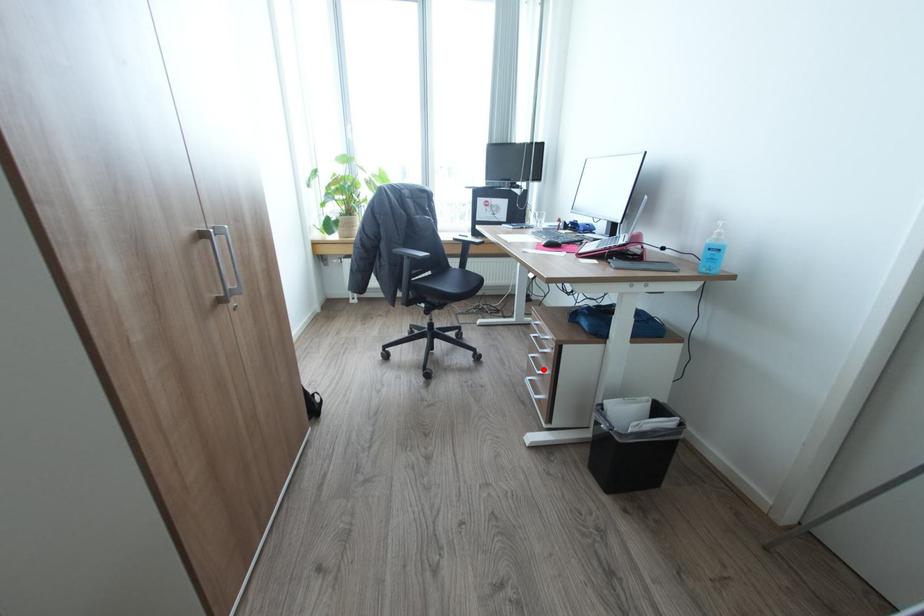
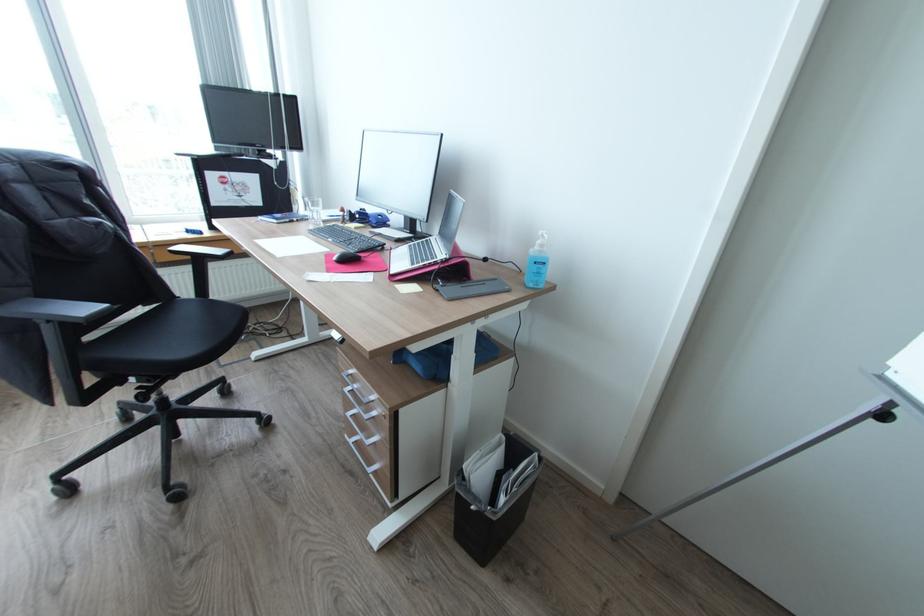
Locate, in the second image, the point that corresponds to the highlighted location in the first image.

(372, 438)